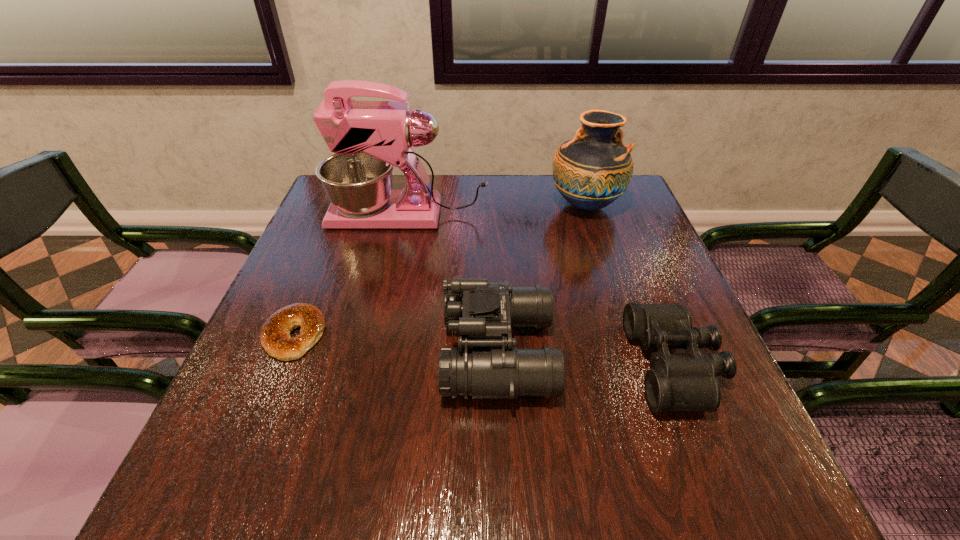
Locate an element on the screen. This screenshot has width=960, height=540. the tallest object is located at coordinates (368, 138).

At what (x,y) coordinates should I click in order to perform the action: click on pottery. Please return your answer as a coordinate pair (x, y). Looking at the image, I should click on [591, 171].

Where is `the left binoculars`? The height and width of the screenshot is (540, 960). the left binoculars is located at coordinates (483, 314).

The height and width of the screenshot is (540, 960). What are the coordinates of `the third shortest object` in the screenshot? It's located at (483, 314).

I want to click on the right binoculars, so click(x=675, y=382).

The height and width of the screenshot is (540, 960). What are the coordinates of `the shorter binoculars` in the screenshot? It's located at (675, 382).

Locate an element on the screen. This screenshot has height=540, width=960. the shortest object is located at coordinates (275, 336).

The image size is (960, 540). I want to click on vacant space located on the left of the pottery, so click(527, 206).

You are a GUI agent. You are given a task and a screenshot of the screen. Output one action in this format:
    pyautogui.click(x=<x>, y=<y>)
    Task: Click on the free region located through the lenses of the left binoculars
    The image size is (960, 540).
    Given the screenshot: What is the action you would take?
    pyautogui.click(x=302, y=353)

Where is `vacant space located 0.130m through the lenses of the left binoculars`? Image resolution: width=960 pixels, height=540 pixels. vacant space located 0.130m through the lenses of the left binoculars is located at coordinates (378, 353).